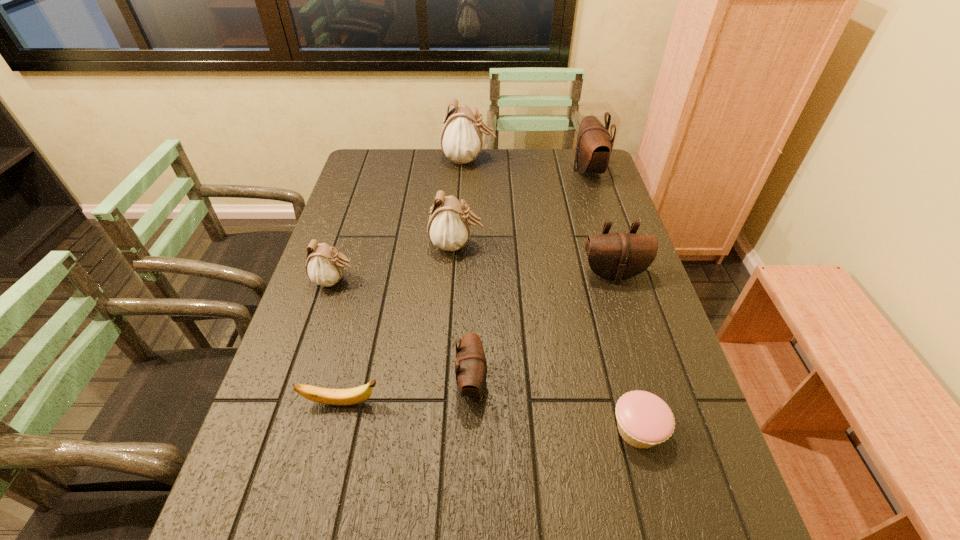
Choose which object is the second nearest neighbor to the nearest white pouch. Please provide its 2D coordinates. Your answer should be formatted as a tuple, i.e. [(x, y)], where the tuple contains the x and y coordinates of a point satisfying the conditions above.

[(351, 396)]

Identify which object is the third closest to the biggest brown pouch. Please provide its 2D coordinates. Your answer should be formatted as a tuple, i.e. [(x, y)], where the tuple contains the x and y coordinates of a point satisfying the conditions above.

[(448, 228)]

Locate which pouch ranks fourth in proximity to the nearest brown pouch. Please provide its 2D coordinates. Your answer should be formatted as a tuple, i.e. [(x, y)], where the tuple contains the x and y coordinates of a point satisfying the conditions above.

[(594, 145)]

Locate an element on the screen. The width and height of the screenshot is (960, 540). pouch that stands as the closest to the second smallest white pouch is located at coordinates (324, 266).

You are a GUI agent. You are given a task and a screenshot of the screen. Output one action in this format:
    pyautogui.click(x=<x>, y=<y>)
    Task: Click on the white pouch that is the second closest to the second smallest white pouch
    This screenshot has height=540, width=960.
    Given the screenshot: What is the action you would take?
    pyautogui.click(x=461, y=139)

Locate an element on the screen. This screenshot has height=540, width=960. the third closest white pouch to the biggest brown pouch is located at coordinates (324, 266).

What are the coordinates of `brown pouch object that ranks as the second closest to the second nearest brown pouch` in the screenshot? It's located at (594, 145).

The image size is (960, 540). I want to click on the second closest brown pouch to the leftmost white pouch, so click(x=618, y=256).

The image size is (960, 540). I want to click on vacant region that satisfies the following two spatial constraints: 1. on the back side of the shortest object; 2. at the stem of the yellow banana, so click(x=631, y=403).

Identify the location of vacant space that satisfies the following two spatial constraints: 1. on the back side of the cupcake; 2. at the stem of the yellow banana. The width and height of the screenshot is (960, 540). (631, 403).